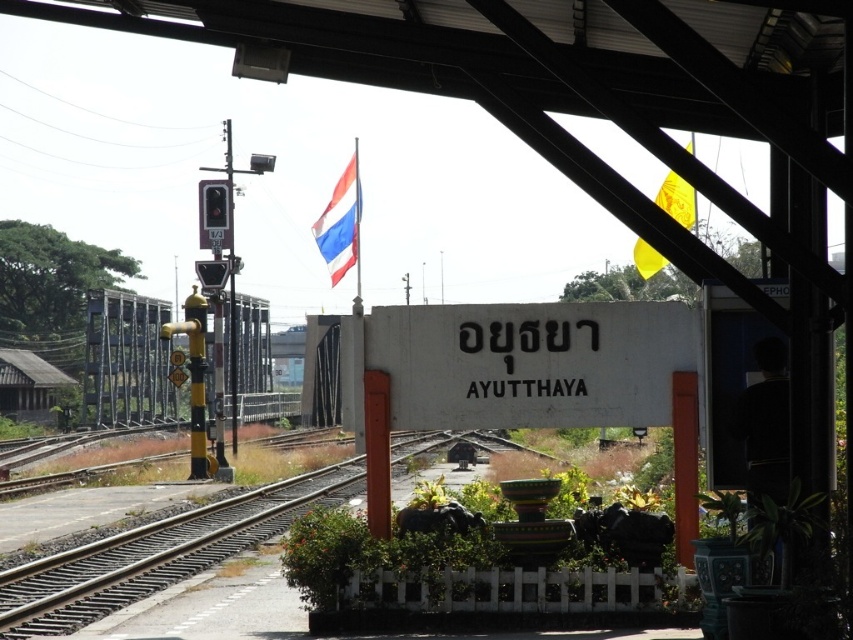
Question: Is polished fabric flag at upper center positioned before yellow fabric flag at upper right?

Choices:
 (A) no
 (B) yes

Answer: (A)

Question: Among these objects, which one is nearest to the camera?

Choices:
 (A) polished fabric flag at upper center
 (B) yellow fabric flag at upper right

Answer: (B)

Question: Which point is farther to the camera?

Choices:
 (A) yellow fabric flag at upper right
 (B) polished fabric flag at upper center

Answer: (B)

Question: Can you confirm if polished fabric flag at upper center is thinner than yellow fabric flag at upper right?

Choices:
 (A) yes
 (B) no

Answer: (B)

Question: Which object appears closest to the camera in this image?

Choices:
 (A) yellow fabric flag at upper right
 (B) polished fabric flag at upper center

Answer: (A)

Question: Is polished fabric flag at upper center below yellow fabric flag at upper right?

Choices:
 (A) yes
 (B) no

Answer: (B)